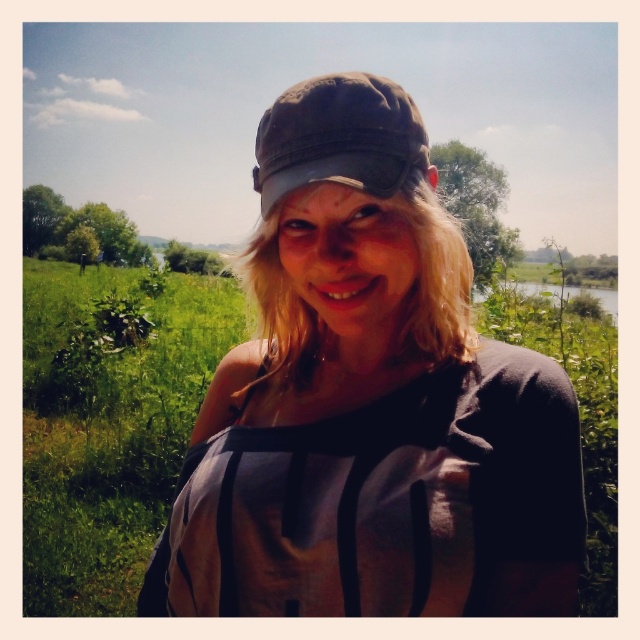
You are a photographer trying to capture both the matte gray cap at center and the dark brown fabric baseball cap at center in a single frame. Which cap should you adjust your camera to focus on first if you want to ensure both are in the shot?

The matte gray cap at center is to the left of dark brown fabric baseball cap at center, so you should focus on the dark brown fabric baseball cap at center first to ensure both are captured in the frame.

You are trying to decide which cap to choose based on width. The person is wearing both a matte gray cap at center and a dark brown fabric baseball cap at center. According to the image, which one is wider?

The matte gray cap at center is wider than the dark brown fabric baseball cap at center.